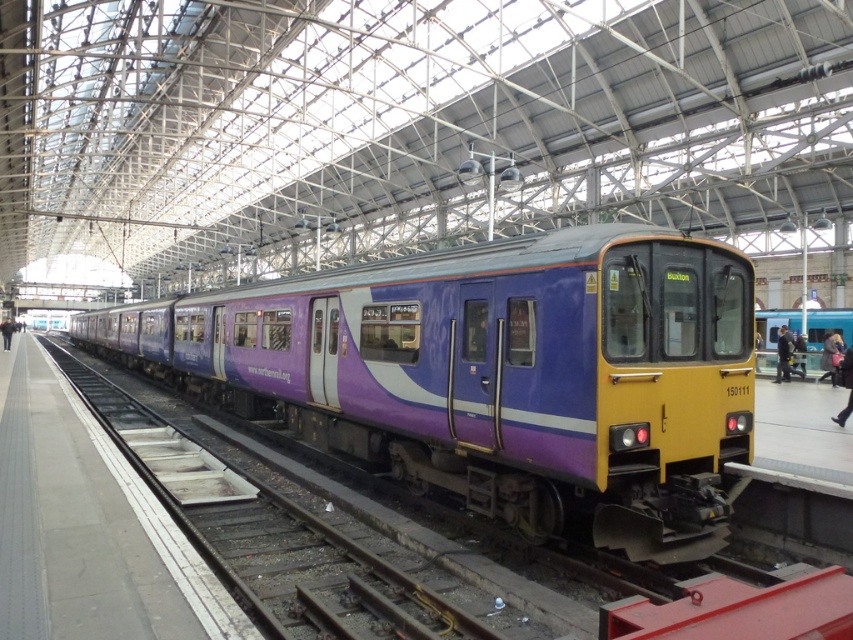
Is purple glossy train at center smaller than dark blue jacket at center?

No.

Which is more to the left, purple glossy train at center or dark blue jacket at center?

From the viewer's perspective, purple glossy train at center appears more on the left side.

Identify the location of purple glossy train at center. (496, 374).